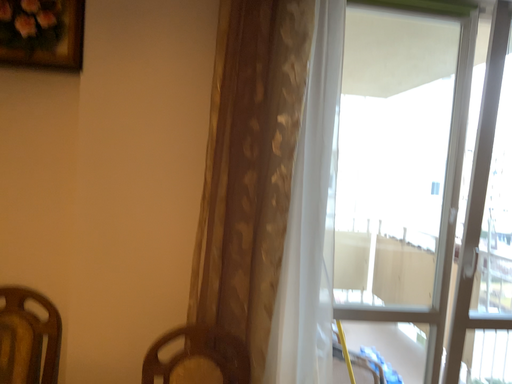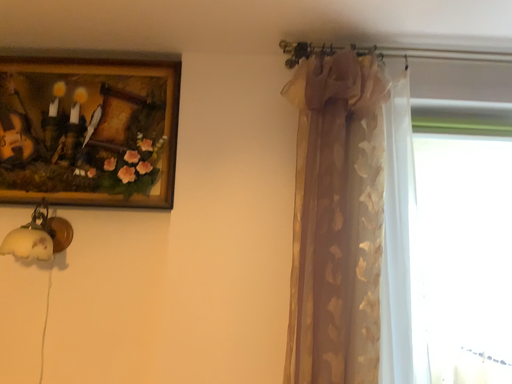
Question: Which way did the camera rotate in the video?

Choices:
 (A) rotated right
 (B) rotated left

Answer: (B)